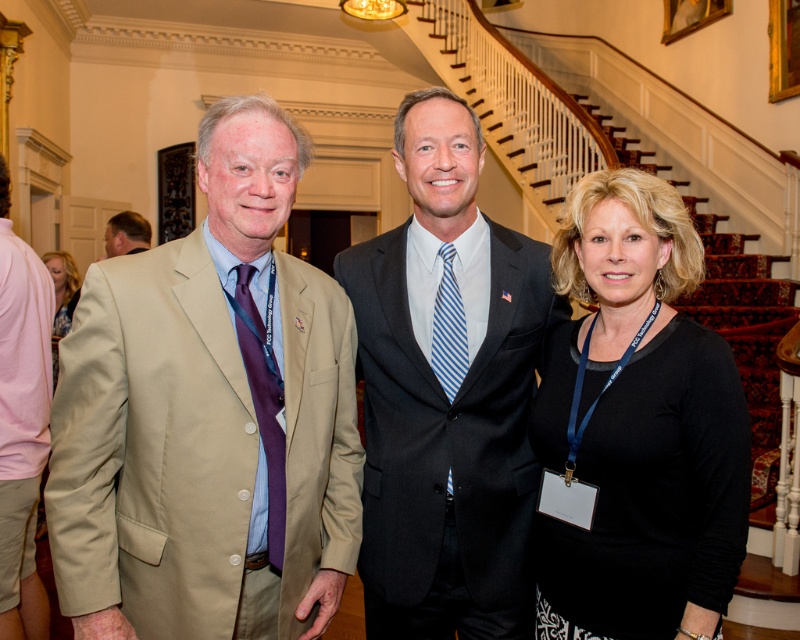
You are a photographer at the event and need to adjust the lighting to ensure both the black matte shirt at center and the matte pink dress at left are well lit. Which one is positioned to the right of the other?

The black matte shirt at center is positioned to the right of the matte pink dress at left.

You are standing in the grand room and need to locate the black matte shirt at center. According to the coordinates provided, where should you look to find it?

The black matte shirt at center is located at point coordinates of 0.667 on the x axis and 0.797 on the y axis.